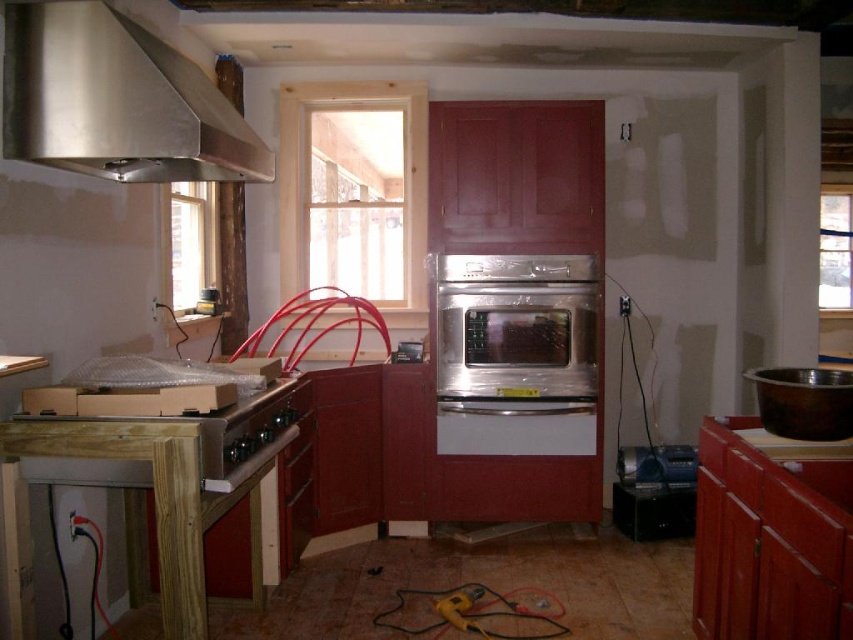
Question: Among these points, which one is nearest to the camera?

Choices:
 (A) pyautogui.click(x=770, y=577)
 (B) pyautogui.click(x=558, y=371)
 (C) pyautogui.click(x=836, y=428)
 (D) pyautogui.click(x=218, y=460)

Answer: (A)

Question: Which of the following is the farthest from the observer?

Choices:
 (A) (820, 420)
 (B) (56, 93)
 (C) (749, 556)

Answer: (B)

Question: Is stainless steel exhaust hood at upper left behind stainless steel sink at right?

Choices:
 (A) no
 (B) yes

Answer: (B)

Question: Where is wooden at center located in relation to stainless steel sink at right in the image?

Choices:
 (A) below
 (B) above

Answer: (A)

Question: Is the position of stainless steel exhaust hood at upper left more distant than that of wooden stove at lower left?

Choices:
 (A) no
 (B) yes

Answer: (B)

Question: Considering the real-world distances, which object is farthest from the wooden stove at lower left?

Choices:
 (A) wooden at center
 (B) stainless steel exhaust hood at upper left
 (C) stainless steel sink at right
 (D) satin stainless steel oven at center

Answer: (C)